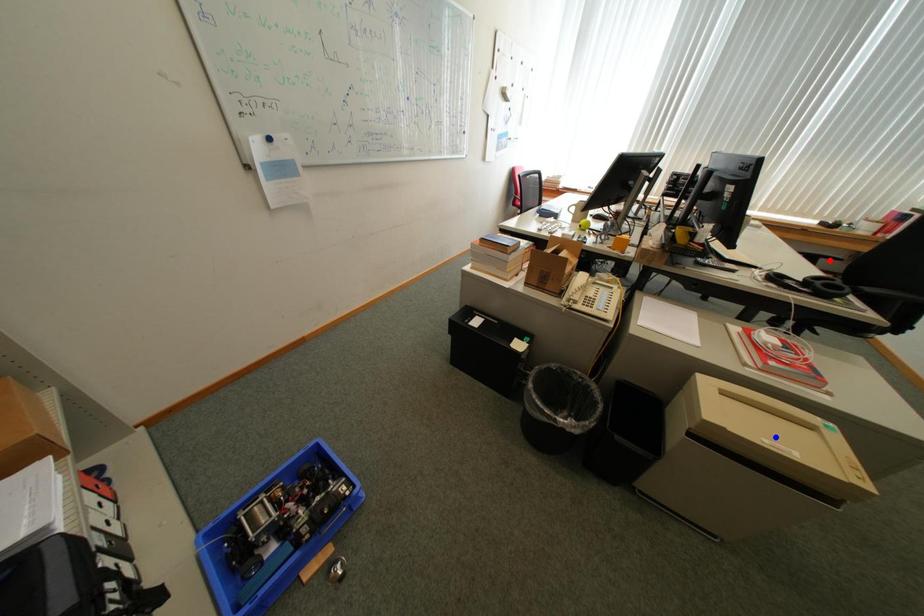
Question: In the image, two points are highlighted. Which point is nearer to the camera? Reply with the corresponding letter.

Choices:
 (A) blue point
 (B) red point

Answer: (A)